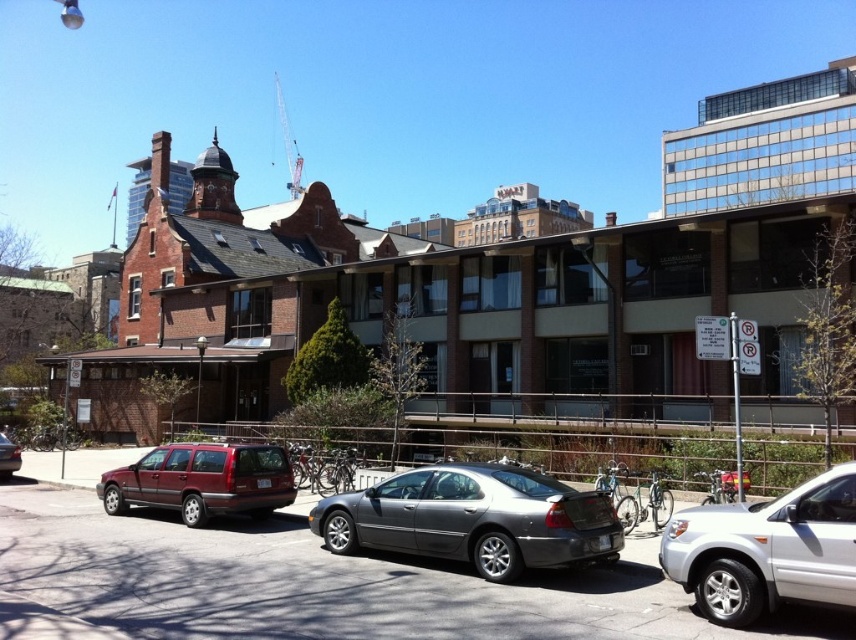
Question: Is metallic gray sedan at center smaller than satin silver sedan at center?

Choices:
 (A) no
 (B) yes

Answer: (A)

Question: Where is satin silver sedan at center located in relation to matte red station wagon at center in the image?

Choices:
 (A) below
 (B) above

Answer: (B)

Question: Is the position of satin silver sedan at center more distant than that of matte red station wagon at lower left?

Choices:
 (A) yes
 (B) no

Answer: (B)

Question: Among these points, which one is farthest from the camera?

Choices:
 (A) (48, 452)
 (B) (497, 561)
 (C) (705, 538)

Answer: (A)

Question: Among these points, which one is nearest to the camera?

Choices:
 (A) (98, 608)
 (B) (688, 580)
 (C) (181, 476)
 (D) (598, 493)

Answer: (B)

Question: Which of the following is the closest to the observer?

Choices:
 (A) (134, 468)
 (B) (376, 596)
 (C) (4, 449)

Answer: (B)